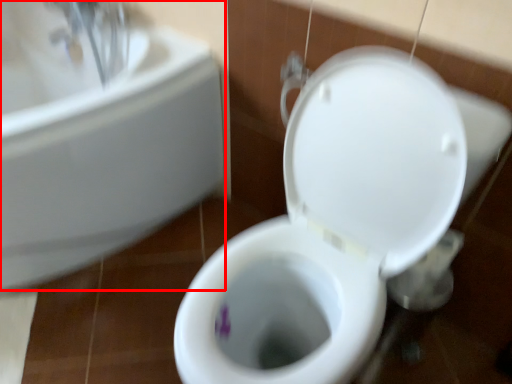
Question: Considering the relative positions of sink (annotated by the red box) and toilet in the image provided, where is sink (annotated by the red box) located with respect to the staircase?

Choices:
 (A) left
 (B) right

Answer: (A)